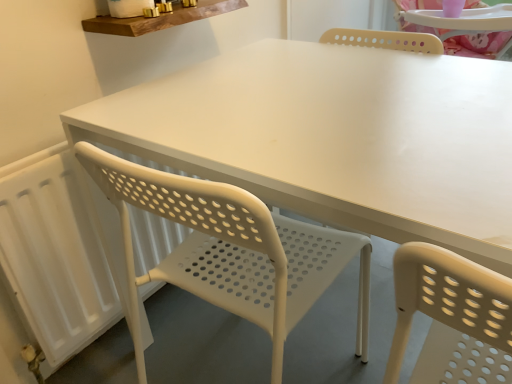
What do you see at coordinates (231, 250) in the screenshot? I see `white perforated plastic chair at center` at bounding box center [231, 250].

The image size is (512, 384). Find the location of `white matte radiator at left`. white matte radiator at left is located at coordinates (59, 253).

You are a GUI agent. You are given a task and a screenshot of the screen. Output one action in this format:
    pyautogui.click(x=<x>, y=<y>)
    Task: Click on the wooden shelf at upper center
    This screenshot has width=512, height=384.
    Given the screenshot: What is the action you would take?
    pyautogui.click(x=160, y=19)

Find the location of a particular element. The width and height of the screenshot is (512, 384). chair that is on the right side of white matte radiator at left is located at coordinates (231, 250).

How different are the orientations of white matte radiator at left and white perforated plastic chair at center in degrees?

white matte radiator at left and white perforated plastic chair at center are facing 89.5 degrees away from each other.

Considering the relative positions of white matte radiator at left and white perforated plastic chair at center in the image provided, is white matte radiator at left to the right of white perforated plastic chair at center from the viewer's perspective?

In fact, white matte radiator at left is to the left of white perforated plastic chair at center.

From a real-world perspective, is white matte radiator at left beneath white perforated plastic chair at center?

Yes, from a real-world perspective, white matte radiator at left is below white perforated plastic chair at center.

Does white perforated plastic chair at center have a greater height compared to wooden shelf at upper center?

Correct, white perforated plastic chair at center is much taller as wooden shelf at upper center.

Does point (100, 175) come in front of point (132, 19)?

Yes, it is in front of point (132, 19).

What's the angular difference between white perforated plastic chair at center and wooden shelf at upper center's facing directions?

89.5 degrees.

Looking at this image, can you see white perforated plastic chair at center touching wooden shelf at upper center?

No, white perforated plastic chair at center is not making contact with wooden shelf at upper center.

The image size is (512, 384). In order to click on radiator that appears below the wooden shelf at upper center (from the image's perspective) in this screenshot , I will do click(x=59, y=253).

Is wooden shelf at upper center facing towards white matte radiator at left?

No, wooden shelf at upper center is not turned towards white matte radiator at left.

From a real-world perspective, does wooden shelf at upper center sit lower than white matte radiator at left?

No, from a real-world perspective, wooden shelf at upper center is not below white matte radiator at left.

Is wooden shelf at upper center thinner than white matte radiator at left?

No, wooden shelf at upper center is not thinner than white matte radiator at left.

Is white perforated plastic chair at center to the left or to the right of white matte radiator at left in the image?

From the image, it's evident that white perforated plastic chair at center is to the right of white matte radiator at left.

How many degrees apart are the facing directions of white perforated plastic chair at center and white matte radiator at left?

The facing directions of white perforated plastic chair at center and white matte radiator at left are 89.5 degrees apart.

From a real-world perspective, which object stands above the other?

white perforated plastic chair at center is physically above.

In terms of height, does white perforated plastic chair at center look taller or shorter compared to white matte radiator at left?

In the image, white perforated plastic chair at center appears to be taller than white matte radiator at left.

From a real-world perspective, does white matte radiator at left stand above wooden shelf at upper center?

No, from a real-world perspective, white matte radiator at left is not over wooden shelf at upper center

Does point (102, 219) come behind point (167, 22)?

Yes, point (102, 219) is behind point (167, 22).

This screenshot has width=512, height=384. In order to click on counter top located behind the white matte radiator at left in this screenshot , I will do `click(160, 19)`.

Considering their positions, is white matte radiator at left located in front of or behind wooden shelf at upper center?

white matte radiator at left is positioned closer to the viewer than wooden shelf at upper center.

Locate an element on the screen. This screenshot has width=512, height=384. counter top lying above the white perforated plastic chair at center (from the image's perspective) is located at coordinates (160, 19).

Which object is positioned more to the right, wooden shelf at upper center or white perforated plastic chair at center?

white perforated plastic chair at center is more to the right.

Consider the image. Which of these two, wooden shelf at upper center or white perforated plastic chair at center, is wider?

white perforated plastic chair at center is wider.

Considering the relative sizes of wooden shelf at upper center and white perforated plastic chair at center in the image provided, is wooden shelf at upper center shorter than white perforated plastic chair at center?

Correct, wooden shelf at upper center is not as tall as white perforated plastic chair at center.

The height and width of the screenshot is (384, 512). Identify the location of radiator lying on the left of white perforated plastic chair at center. (59, 253).

Where is `chair that is on the right side of wooden shelf at upper center`? chair that is on the right side of wooden shelf at upper center is located at coordinates (231, 250).

Estimate the real-world distances between objects in this image. Which object is closer to white perforated plastic chair at center, wooden shelf at upper center or white matte radiator at left?

Among the two, white matte radiator at left is located nearer to white perforated plastic chair at center.

Which object lies further to the anchor point white matte radiator at left, wooden shelf at upper center or white perforated plastic chair at center?

Among the two, wooden shelf at upper center is located further to white matte radiator at left.

Estimate the real-world distances between objects in this image. Which object is further from white perforated plastic chair at center, white matte radiator at left or wooden shelf at upper center?

The object further to white perforated plastic chair at center is wooden shelf at upper center.

When comparing their distances from wooden shelf at upper center, does white matte radiator at left or white perforated plastic chair at center seem further?

white perforated plastic chair at center lies further to wooden shelf at upper center than the other object.

Considering their positions, is white perforated plastic chair at center positioned closer to white matte radiator at left than wooden shelf at upper center?

Based on the image, white perforated plastic chair at center appears to be nearer to white matte radiator at left.

When comparing their distances from wooden shelf at upper center, does white perforated plastic chair at center or white matte radiator at left seem closer?

Among the two, white matte radiator at left is located nearer to wooden shelf at upper center.

Identify the location of radiator that lies between wooden shelf at upper center and white perforated plastic chair at center from top to bottom. The width and height of the screenshot is (512, 384). (59, 253).